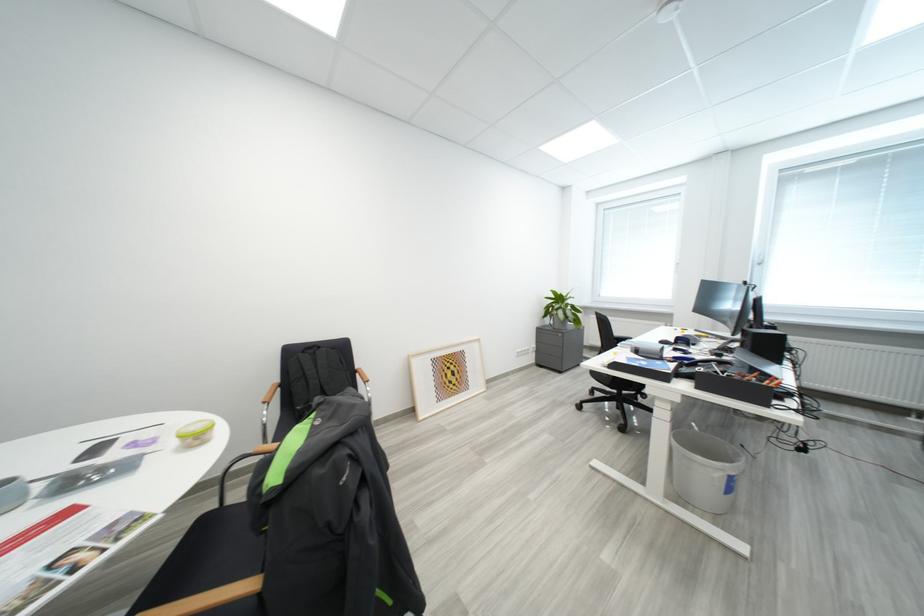
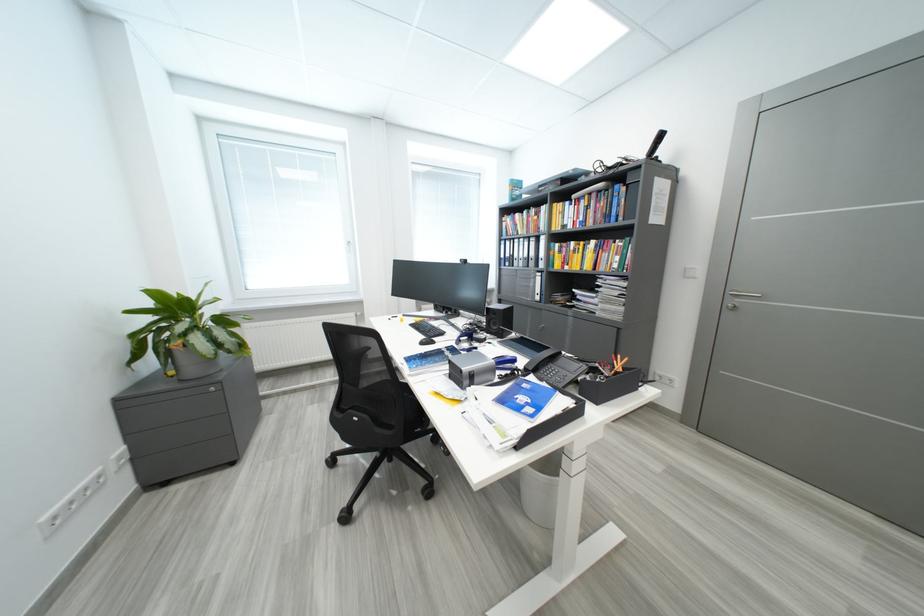
The point at (565,310) is marked in the first image. Where is the corresponding point in the second image?

(189, 331)